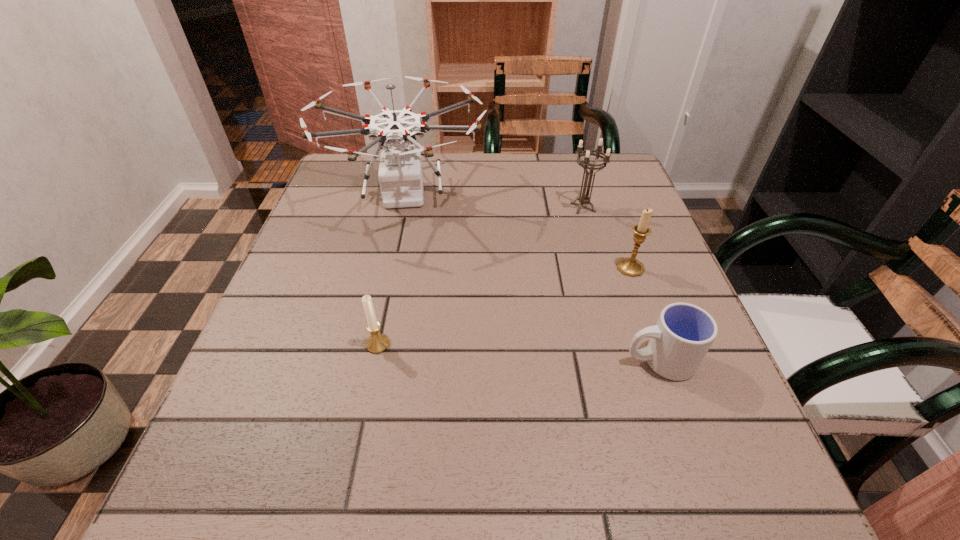
This screenshot has height=540, width=960. In order to click on vacant space that satisfies the following two spatial constraints: 1. on the back side of the second shortest object; 2. on the right side of the third nearest object in this screenshot , I will do `click(394, 268)`.

Find the location of a particular element. free space that satisfies the following two spatial constraints: 1. on the back side of the second shortest object; 2. on the left side of the second farthest candle holder is located at coordinates (394, 268).